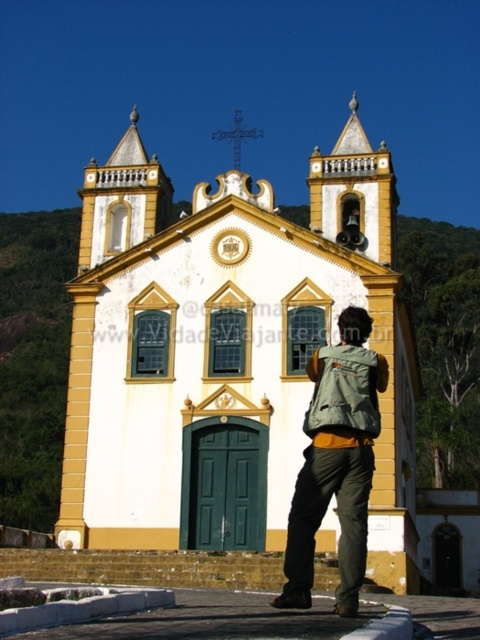
Is green fabric backpack at center thinner than green canvas backpack at lower center?

In fact, green fabric backpack at center might be wider than green canvas backpack at lower center.

Which is in front, point (311, 461) or point (342, 352)?

Point (311, 461)

This screenshot has width=480, height=640. Find the location of `green fabric backpack at center`. green fabric backpack at center is located at coordinates (336, 461).

Is point (122, 403) farther from camera compared to point (317, 513)?

That is True.

Between yellow painted stone church at center and green fabric backpack at center, which one has less height?

With less height is green fabric backpack at center.

Between point (148, 387) and point (343, 561), which one is positioned behind?

Point (148, 387)

The height and width of the screenshot is (640, 480). In order to click on yellow painted stone church at center in this screenshot , I will do `click(227, 349)`.

Between yellow painted stone church at center and green canvas backpack at lower center, which one is positioned higher?

yellow painted stone church at center

Is yellow painted stone church at center wider than green canvas backpack at lower center?

Correct, the width of yellow painted stone church at center exceeds that of green canvas backpack at lower center.

Which is in front, point (97, 300) or point (309, 413)?

Point (309, 413) is in front.

Where is `yellow painted stone church at center`? This screenshot has width=480, height=640. yellow painted stone church at center is located at coordinates (227, 349).